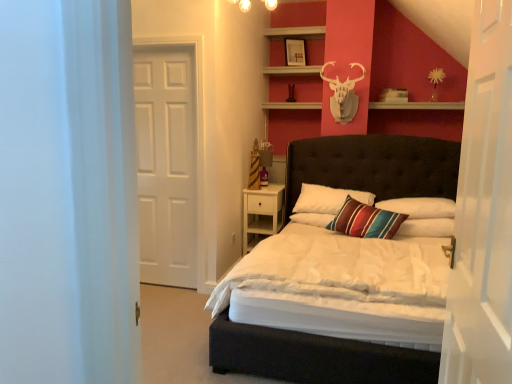
This screenshot has height=384, width=512. What do you see at coordinates (426, 227) in the screenshot?
I see `striped fabric pillow at center, which appears as the third pillow when viewed from the left` at bounding box center [426, 227].

The width and height of the screenshot is (512, 384). What do you see at coordinates (261, 214) in the screenshot?
I see `white wood nightstand at lower right` at bounding box center [261, 214].

Locate an element on the screen. This screenshot has height=384, width=512. white wood nightstand at lower right is located at coordinates (261, 214).

I want to click on striped fabric pillow at center, marked as the 3th pillow in a right-to-left arrangement, so click(327, 199).

Is matte black bed at center not within striped fabric pillow at center, which appears as the 1th pillow when viewed from the left?

Absolutely, matte black bed at center is external to striped fabric pillow at center, which appears as the 1th pillow when viewed from the left.

Looking at the image, does matte black bed at center seem bigger or smaller compared to striped fabric pillow at center, which appears as the 1th pillow when viewed from the left?

matte black bed at center is bigger than striped fabric pillow at center, which appears as the 1th pillow when viewed from the left.

Is matte black bed at center beside striped fabric pillow at center, which appears as the 1th pillow when viewed from the left?

matte black bed at center and striped fabric pillow at center, which appears as the 1th pillow when viewed from the left, are not in contact.

Can you confirm if matte black bed at center is shorter than striped fabric pillow at center, marked as the 3th pillow in a right-to-left arrangement?

Incorrect, the height of matte black bed at center does not fall short of that of striped fabric pillow at center, marked as the 3th pillow in a right-to-left arrangement.

From the image's perspective, does white glossy door at right, the 1th door from the right, appear lower than wooden shelf at upper center?

Correct, white glossy door at right, the 1th door from the right, appears lower than wooden shelf at upper center in the image.

Considering the relative positions of white glossy door at right, which ranks as the 2th door in back-to-front order, and wooden shelf at upper center in the image provided, is white glossy door at right, which ranks as the 2th door in back-to-front order, to the left or to the right of wooden shelf at upper center?

Based on their positions, white glossy door at right, which ranks as the 2th door in back-to-front order, is located to the left of wooden shelf at upper center.

Considering the sizes of white glossy door at right, the first door viewed from the front, and wooden shelf at upper center in the image, is white glossy door at right, the first door viewed from the front, taller or shorter than wooden shelf at upper center?

In the image, white glossy door at right, the first door viewed from the front, appears to be taller than wooden shelf at upper center.

Between point (441, 202) and point (268, 377), which one is positioned behind?

The point (441, 202) is more distant.

Which is more to the right, striped fabric pillow at center, the 2th pillow in the right-to-left sequence, or matte black bed at center?

Positioned to the right is striped fabric pillow at center, the 2th pillow in the right-to-left sequence.

How much distance is there between striped fabric pillow at center, placed as the second pillow when sorted from left to right, and matte black bed at center?

striped fabric pillow at center, placed as the second pillow when sorted from left to right, and matte black bed at center are 14.73 inches apart.

There is a matte black bed at center. At what (x,y) coordinates should I click in order to perform the action: click on the 2nd pillow above it (from a real-world perspective). Please return your answer as a coordinate pair (x, y). Image resolution: width=512 pixels, height=384 pixels. Looking at the image, I should click on (420, 207).

In terms of height, does striped fabric pillow at center, which appears as the third pillow when viewed from the left, look taller or shorter compared to striped fabric pillow at center, marked as the 3th pillow in a right-to-left arrangement?

Clearly, striped fabric pillow at center, which appears as the third pillow when viewed from the left, is shorter compared to striped fabric pillow at center, marked as the 3th pillow in a right-to-left arrangement.

In the image, is striped fabric pillow at center, the first pillow from the right, positioned in front of or behind striped fabric pillow at center, which appears as the 1th pillow when viewed from the left?

striped fabric pillow at center, the first pillow from the right, is positioned closer to the viewer than striped fabric pillow at center, which appears as the 1th pillow when viewed from the left.

Is striped fabric pillow at center, the first pillow from the right, not inside striped fabric pillow at center, marked as the 3th pillow in a right-to-left arrangement?

striped fabric pillow at center, the first pillow from the right, is positioned outside striped fabric pillow at center, marked as the 3th pillow in a right-to-left arrangement.

Is striped fabric pillow at center, which appears as the third pillow when viewed from the left, with striped fabric pillow at center, which appears as the 1th pillow when viewed from the left?

striped fabric pillow at center, which appears as the third pillow when viewed from the left, is not next to striped fabric pillow at center, which appears as the 1th pillow when viewed from the left, and they're not touching.

Considering the positions of objects white glossy door at right, the first door viewed from the front, and white matte door at left, the 1th door viewed from the left, in the image provided, who is more to the left, white glossy door at right, the first door viewed from the front, or white matte door at left, the 1th door viewed from the left,?

Positioned to the left is white matte door at left, the 1th door viewed from the left.

Is white glossy door at right, the first door viewed from the front, positioned with its back to white matte door at left, which ranks as the 2th door in front-to-back order?

No, white glossy door at right, the first door viewed from the front,'s orientation is not away from white matte door at left, which ranks as the 2th door in front-to-back order.

Is white glossy door at right, the first door viewed from the front, in front of or behind white matte door at left, which ranks as the 2th door in front-to-back order, in the image?

Clearly, white glossy door at right, the first door viewed from the front, is in front of white matte door at left, which ranks as the 2th door in front-to-back order.

Is white glossy door at right, the second door positioned from the left, located outside white matte door at left, which ranks as the 1th door in back-to-front order?

That's correct, white glossy door at right, the second door positioned from the left, is outside of white matte door at left, which ranks as the 1th door in back-to-front order.

Considering the sizes of white matte door at left, positioned as the 2th door in right-to-left order, and striped fabric pillow at center, placed as the second pillow when sorted from left to right, in the image, is white matte door at left, positioned as the 2th door in right-to-left order, bigger or smaller than striped fabric pillow at center, placed as the second pillow when sorted from left to right,?

In the image, white matte door at left, positioned as the 2th door in right-to-left order, appears to be larger than striped fabric pillow at center, placed as the second pillow when sorted from left to right.

Is white matte door at left, which ranks as the 1th door in back-to-front order, wider than striped fabric pillow at center, the 2th pillow in the right-to-left sequence?

No.

Between white matte door at left, which ranks as the 1th door in back-to-front order, and striped fabric pillow at center, the 2th pillow in the right-to-left sequence, which one has less height?

With less height is striped fabric pillow at center, the 2th pillow in the right-to-left sequence.

Which is more to the left, white matte door at left, positioned as the 2th door in right-to-left order, or striped fabric pillow at center, the 2th pillow in the right-to-left sequence?

From the viewer's perspective, white matte door at left, positioned as the 2th door in right-to-left order, appears more on the left side.

At what (x,y) coordinates should I click in order to perform the action: click on bed directly beneath the white matte door at left, which ranks as the 2th door in front-to-back order (from a real-world perspective). Please return your answer as a coordinate pair (x, y). Looking at the image, I should click on (312, 358).

Is the surface of white matte door at left, which ranks as the 1th door in back-to-front order, in direct contact with matte black bed at center?

No, white matte door at left, which ranks as the 1th door in back-to-front order, is not beside matte black bed at center.

From a real-world perspective, is white matte door at left, which ranks as the 2th door in front-to-back order, over matte black bed at center?

Yes, from a real-world perspective, white matte door at left, which ranks as the 2th door in front-to-back order, is over matte black bed at center

Does white matte door at left, the 1th door viewed from the left, turn towards matte black bed at center?

No, white matte door at left, the 1th door viewed from the left, is not aimed at matte black bed at center.

From a real-world perspective, starting from the matte black bed at center, which pillow is the 1st one vertically above it? Please provide its 2D coordinates.

[(327, 199)]

I want to click on shelf behind the white glossy door at right, the first door viewed from the front, so click(x=418, y=106).

Estimate the real-world distances between objects in this image. Which object is further from striped fabric pillow at center, placed as the second pillow when sorted from left to right, white matte door at left, the 1th door viewed from the left, or matte black bed at center?

white matte door at left, the 1th door viewed from the left, is further to striped fabric pillow at center, placed as the second pillow when sorted from left to right.

Based on their spatial positions, is striped fabric pillow at center, marked as the 3th pillow in a right-to-left arrangement, or matte black bed at center further from white matte door at left, positioned as the 2th door in right-to-left order?

matte black bed at center lies further to white matte door at left, positioned as the 2th door in right-to-left order, than the other object.

Which object lies nearer to the anchor point striped fabric pillow at center, which appears as the third pillow when viewed from the left, wooden shelf at upper center or striped fabric pillow at center, marked as the 3th pillow in a right-to-left arrangement?

striped fabric pillow at center, marked as the 3th pillow in a right-to-left arrangement, is closer to striped fabric pillow at center, which appears as the third pillow when viewed from the left.

Looking at the image, which one is located closer to white wood nightstand at lower right, matte black bed at center or white matte door at left, which ranks as the 2th door in front-to-back order?

Based on the image, matte black bed at center appears to be nearer to white wood nightstand at lower right.

Considering their positions, is striped fabric pillow at center, placed as the second pillow when sorted from left to right, positioned further to matte black bed at center than striped fabric pillow at center, marked as the 3th pillow in a right-to-left arrangement?

striped fabric pillow at center, placed as the second pillow when sorted from left to right, is further to matte black bed at center.

Based on their spatial positions, is white matte door at left, positioned as the 2th door in right-to-left order, or white glossy door at right, the second door positioned from the left, closer to white wood nightstand at lower right?

white matte door at left, positioned as the 2th door in right-to-left order, is closer to white wood nightstand at lower right.

Considering their positions, is matte black bed at center positioned further to wooden shelf at upper center than striped fabric pillow at center, which appears as the 1th pillow when viewed from the left?

striped fabric pillow at center, which appears as the 1th pillow when viewed from the left, is positioned further to the anchor wooden shelf at upper center.

Which object lies nearer to the anchor point white wood nightstand at lower right, matte white picture frame at upper center or white matte door at left, which ranks as the 1th door in back-to-front order?

white matte door at left, which ranks as the 1th door in back-to-front order, lies closer to white wood nightstand at lower right than the other object.

I want to click on pillow located between white matte door at left, which ranks as the 2th door in front-to-back order, and striped fabric pillow at center, the 2th pillow in the right-to-left sequence, in the left-right direction, so 327,199.

This screenshot has height=384, width=512. What are the coordinates of `picture frame between white matte door at left, which ranks as the 1th door in back-to-front order, and wooden shelf at upper center` in the screenshot? It's located at (295, 52).

This screenshot has height=384, width=512. I want to click on nightstand between matte black bed at center and wooden shelf at upper center in the front-back direction, so click(261, 214).

Where is `bed between white glossy door at right, which ranks as the 2th door in back-to-front order, and striped fabric pillow at center, the first pillow from the right, along the z-axis`? The image size is (512, 384). bed between white glossy door at right, which ranks as the 2th door in back-to-front order, and striped fabric pillow at center, the first pillow from the right, along the z-axis is located at coordinates (312, 358).